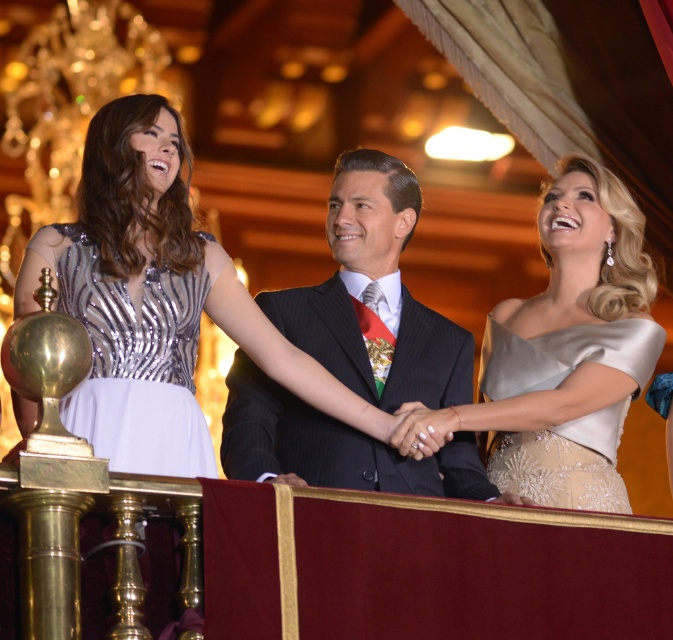
In the scene described, there is a dark pinstripe suit at center and a satin beige dress at upper right. Based on their positions, which object is located to the left of the other?

The dark pinstripe suit at center is to the left of the satin beige dress at upper right.

You are a photographer at the event and want to capture both the satin beige dress at upper right and the silver sequined dress at left in the same frame. Which dress should you focus on to ensure both are in focus without moving the camera?

You should focus on the satin beige dress at upper right because the silver sequined dress at left is behind it, so keeping the satin beige dress in focus will also keep the silver sequined dress in focus due to their proximity in depth.